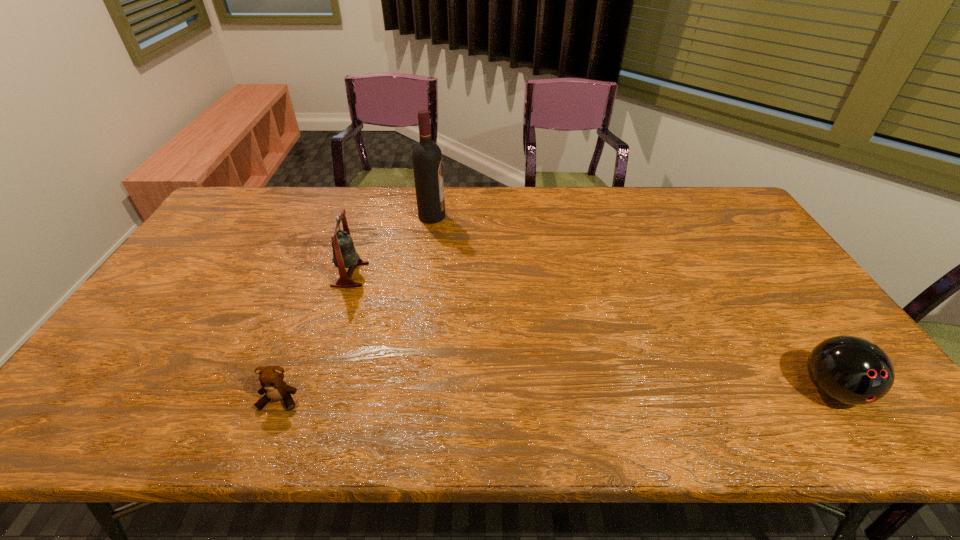
Identify the location of vacant area that lies between the second shortest object and the tallest object. The image size is (960, 540). pyautogui.click(x=632, y=303).

This screenshot has width=960, height=540. What are the coordinates of `vacant point located between the tallest object and the third nearest object` in the screenshot? It's located at (391, 245).

The width and height of the screenshot is (960, 540). I want to click on free space between the third tallest object and the bell, so click(x=590, y=332).

At what (x,y) coordinates should I click in order to perform the action: click on free space between the teddy bear and the rightmost object. Please return your answer as a coordinate pair (x, y). Looking at the image, I should click on (556, 395).

The height and width of the screenshot is (540, 960). Find the location of `empty location between the farthest object and the shortest object`. empty location between the farthest object and the shortest object is located at coordinates (356, 308).

Locate an element on the screen. Image resolution: width=960 pixels, height=540 pixels. free space between the tallest object and the bowling ball is located at coordinates (632, 303).

Where is `free point between the rightmost object and the wine bottle`? free point between the rightmost object and the wine bottle is located at coordinates (632, 303).

Find the location of a particular element. The height and width of the screenshot is (540, 960). free space between the third nearest object and the bowling ball is located at coordinates (590, 332).

This screenshot has height=540, width=960. I want to click on empty space between the rightmost object and the teddy bear, so click(556, 395).

Identify the location of vacant area that lies between the bowling ball and the shortest object. This screenshot has width=960, height=540. (556, 395).